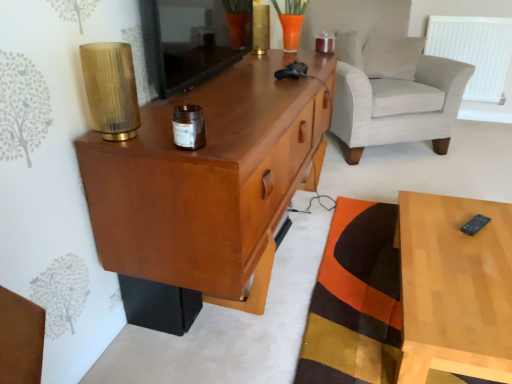
The height and width of the screenshot is (384, 512). In order to click on shiny metallic candle at upper center, which appears as the second candle holder when viewed from the left in this screenshot , I will do `click(325, 43)`.

The height and width of the screenshot is (384, 512). What do you see at coordinates (189, 127) in the screenshot?
I see `brown glass jar at center, which appears as the 1th candle holder when ordered from the bottom` at bounding box center [189, 127].

How much space does brown glass jar at center, acting as the first candle holder starting from the front, occupy horizontally?

The width of brown glass jar at center, acting as the first candle holder starting from the front, is 9.50 centimeters.

Describe the element at coordinates (111, 89) in the screenshot. The width and height of the screenshot is (512, 384). I see `translucent bamboo lamp at upper left` at that location.

I want to click on white plastic radiator at upper right, so click(474, 51).

This screenshot has height=384, width=512. What are the coordinates of `white textured pillow at upper right` in the screenshot? It's located at (392, 56).

You are a GUI agent. You are given a task and a screenshot of the screen. Output one action in this format:
    pyautogui.click(x=<x>, y=<y>)
    Task: Click on the shiny metallic candle at upper center, the 2th candle holder in the front-to-back sequence
    
    Given the screenshot: What is the action you would take?
    pyautogui.click(x=325, y=43)

Is point (119, 228) closer or farther from the camera than point (148, 48)?

Point (119, 228) appears to be closer to the viewer than point (148, 48).

Between matte wood cabinet at left and smooth wooden mirror at upper center, which one appears on the left side from the viewer's perspective?

smooth wooden mirror at upper center is more to the left.

Is matte wood cabinet at left oriented towards smooth wooden mirror at upper center?

No, matte wood cabinet at left does not turn towards smooth wooden mirror at upper center.

From the image's perspective, is matte wood cabinet at left positioned above or below smooth wooden mirror at upper center?

From the image's perspective, matte wood cabinet at left appears below smooth wooden mirror at upper center.

Which object is positioned more to the left, white plastic radiator at upper right or brown glass jar at center, which appears as the first candle holder when viewed from the left?

brown glass jar at center, which appears as the first candle holder when viewed from the left.

Is point (502, 26) in front of point (185, 120)?

That is False.

Is white plastic radiator at upper right thinner than brown glass jar at center, the second candle holder when ordered from top to bottom?

No, white plastic radiator at upper right is not thinner than brown glass jar at center, the second candle holder when ordered from top to bottom.

Is white plastic radiator at upper right positioned with its back to brown glass jar at center, which appears as the first candle holder when viewed from the left?

white plastic radiator at upper right is not turned away from brown glass jar at center, which appears as the first candle holder when viewed from the left.

Is shiny metallic candle at upper center, acting as the first candle holder starting from the top, inside the boundaries of translucent bamboo lamp at upper left, or outside?

The correct answer is: outside.

Identify the location of candle holder above the translucent bamboo lamp at upper left (from the image's perspective). (325, 43).

Is shiny metallic candle at upper center, acting as the first candle holder starting from the top, aimed at translucent bamboo lamp at upper left?

No, shiny metallic candle at upper center, acting as the first candle holder starting from the top, is not turned towards translucent bamboo lamp at upper left.

From a real-world perspective, is shiny metallic candle at upper center, the 2th candle holder in the bottom-to-top sequence, above or below translucent bamboo lamp at upper left?

Clearly, from a real-world perspective, shiny metallic candle at upper center, the 2th candle holder in the bottom-to-top sequence, is below translucent bamboo lamp at upper left.

Is matte wood cabinet at left touching white plastic radiator at upper right?

matte wood cabinet at left is not next to white plastic radiator at upper right, and they're not touching.

Would you say matte wood cabinet at left is outside white plastic radiator at upper right?

That's correct, matte wood cabinet at left is outside of white plastic radiator at upper right.

Consider the image. Is matte wood cabinet at left positioned with its back to white plastic radiator at upper right?

No, matte wood cabinet at left is not facing away from white plastic radiator at upper right.

Between matte wood cabinet at left and white plastic radiator at upper right, which one has less height?

With less height is white plastic radiator at upper right.

Between white textured pillow at upper right and white striped fabric armchair at upper right, which one has larger width?

white striped fabric armchair at upper right.

Which point is more forward, (404, 47) or (352, 92)?

The point (352, 92) is closer to the camera.

From the image's perspective, which one is positioned higher, white textured pillow at upper right or white striped fabric armchair at upper right?

white textured pillow at upper right.

From a real-world perspective, is white textured pillow at upper right over white striped fabric armchair at upper right?

Correct, in the physical world, white textured pillow at upper right is higher than white striped fabric armchair at upper right.

Is smooth wooden mirror at upper center next to orange patchwork mat at lower right?

No, smooth wooden mirror at upper center is not touching orange patchwork mat at lower right.

Can orange patchwork mat at lower right be found inside smooth wooden mirror at upper center?

No, smooth wooden mirror at upper center does not contain orange patchwork mat at lower right.

Is smooth wooden mirror at upper center taller than orange patchwork mat at lower right?

Yes, smooth wooden mirror at upper center is taller than orange patchwork mat at lower right.

Is smooth wooden mirror at upper center looking in the opposite direction of orange patchwork mat at lower right?

smooth wooden mirror at upper center does not have its back to orange patchwork mat at lower right.

Which is in front, point (325, 32) or point (458, 224)?

Positioned in front is point (458, 224).

Considering the relative sizes of shiny metallic candle at upper center, which appears as the second candle holder when viewed from the left, and light brown wood at right in the image provided, is shiny metallic candle at upper center, which appears as the second candle holder when viewed from the left, taller than light brown wood at right?

No.

Considering the positions of objects shiny metallic candle at upper center, the first candle holder from the back, and light brown wood at right in the image provided, who is more to the right, shiny metallic candle at upper center, the first candle holder from the back, or light brown wood at right?

light brown wood at right is more to the right.

Locate an element on the screen. cabinetry that is below the smooth wooden mirror at upper center (from the image's perspective) is located at coordinates [211, 180].

The width and height of the screenshot is (512, 384). Find the location of `radiator on the right side of brown glass jar at center, which appears as the first candle holder when viewed from the left`. radiator on the right side of brown glass jar at center, which appears as the first candle holder when viewed from the left is located at coordinates (474, 51).

From the image, which object appears to be farther from shiny metallic candle at upper center, the first candle holder from the back, orange patchwork mat at lower right or white striped fabric armchair at upper right?

orange patchwork mat at lower right lies further to shiny metallic candle at upper center, the first candle holder from the back, than the other object.

Estimate the real-world distances between objects in this image. Which object is further from matte wood cabinet at left, shiny metallic candle at upper center, the 2th candle holder in the bottom-to-top sequence, or white striped fabric armchair at upper right?

Based on the image, white striped fabric armchair at upper right appears to be further to matte wood cabinet at left.

When comparing their distances from shiny metallic candle at upper center, acting as the first candle holder starting from the top, does orange patchwork mat at lower right or brown glass jar at center, which appears as the first candle holder when viewed from the left, seem closer?

orange patchwork mat at lower right lies closer to shiny metallic candle at upper center, acting as the first candle holder starting from the top, than the other object.

Considering their positions, is white textured pillow at upper right positioned further to white plastic radiator at upper right than brown glass jar at center, which appears as the first candle holder when viewed from the left?

brown glass jar at center, which appears as the first candle holder when viewed from the left, is further to white plastic radiator at upper right.

Based on their spatial positions, is translucent bamboo lamp at upper left or light brown wood at right further from brown glass jar at center, which is the second candle holder in right-to-left order?

Based on the image, light brown wood at right appears to be further to brown glass jar at center, which is the second candle holder in right-to-left order.

Estimate the real-world distances between objects in this image. Which object is further from brown glass jar at center, which is counted as the 2th candle holder, starting from the back, white plastic radiator at upper right or matte wood cabinet at left?

Based on the image, white plastic radiator at upper right appears to be further to brown glass jar at center, which is counted as the 2th candle holder, starting from the back.

From the image, which object appears to be farther from matte wood cabinet at left, shiny metallic candle at upper center, which appears as the second candle holder when viewed from the left, or brown glass jar at center, which appears as the 1th candle holder when ordered from the bottom?

Among the two, shiny metallic candle at upper center, which appears as the second candle holder when viewed from the left, is located further to matte wood cabinet at left.

Which object lies further to the anchor point white plastic radiator at upper right, matte wood cabinet at left or orange patchwork mat at lower right?

matte wood cabinet at left is further to white plastic radiator at upper right.

Where is `mirror positioned between translucent bamboo lamp at upper left and white textured pillow at upper right from near to far`? The height and width of the screenshot is (384, 512). mirror positioned between translucent bamboo lamp at upper left and white textured pillow at upper right from near to far is located at coordinates (190, 41).

You are a GUI agent. You are given a task and a screenshot of the screen. Output one action in this format:
    pyautogui.click(x=<x>, y=<y>)
    Task: Click on the mirror between light brown wood at right and white plastic radiator at upper right from front to back
    
    Given the screenshot: What is the action you would take?
    pyautogui.click(x=190, y=41)

Find the location of a particular element. This screenshot has height=384, width=512. mirror between brown glass jar at center, acting as the first candle holder starting from the front, and white textured pillow at upper right from front to back is located at coordinates (190, 41).

Find the location of `desk positioned between matte wood cabinet at left and shiny metallic candle at upper center, the first candle holder from the back, from near to far`. desk positioned between matte wood cabinet at left and shiny metallic candle at upper center, the first candle holder from the back, from near to far is located at coordinates (455, 288).